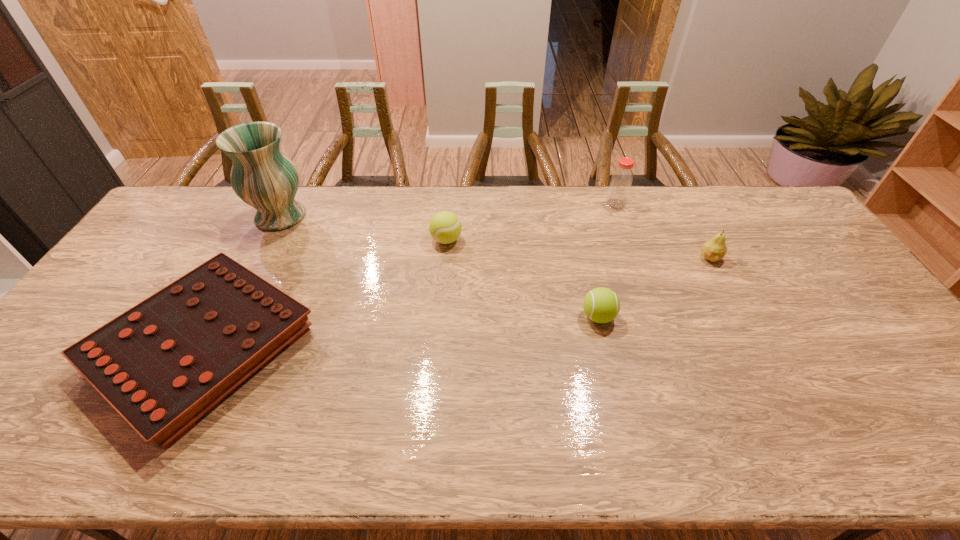
In order to click on free space between the farther tennis ball and the tallest object in this screenshot , I will do `click(364, 228)`.

This screenshot has height=540, width=960. Identify the location of vacant space in between the nearer tennis ball and the fifth object from left to right. (607, 260).

At what (x,y) coordinates should I click in order to perform the action: click on vacant space that's between the gameboard and the fourth object from left to right. Please return your answer as a coordinate pair (x, y). The image size is (960, 540). Looking at the image, I should click on (401, 332).

Where is `free spot between the tallest object and the pear`? The width and height of the screenshot is (960, 540). free spot between the tallest object and the pear is located at coordinates (495, 237).

This screenshot has width=960, height=540. I want to click on empty space between the left tennis ball and the tallest object, so click(364, 228).

Locate an element on the screen. The height and width of the screenshot is (540, 960). object identified as the fourth closest to the rightmost object is located at coordinates (162, 364).

Where is `object that is the closest to the fifth shortest object`? Image resolution: width=960 pixels, height=540 pixels. object that is the closest to the fifth shortest object is located at coordinates (714, 249).

This screenshot has height=540, width=960. In order to click on vacant space that satisfies the following two spatial constraints: 1. on the front side of the nearer tennis ball; 2. on the left side of the third object from left to right in this screenshot , I will do `click(441, 316)`.

You are a GUI agent. You are given a task and a screenshot of the screen. Output one action in this format:
    pyautogui.click(x=<x>, y=<y>)
    Task: Click on the vacant space that satisfies the following two spatial constraints: 1. on the back side of the shortest object; 2. on the left side of the left tennis ball
    The height and width of the screenshot is (540, 960).
    Given the screenshot: What is the action you would take?
    pyautogui.click(x=260, y=240)